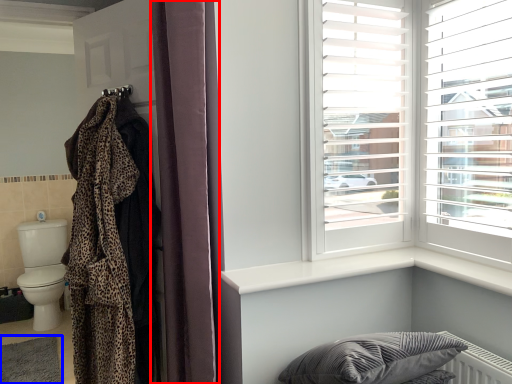
Question: Which object appears closest to the camera in this image, curtain (highlighted by a red box) or mat (highlighted by a blue box)?

Choices:
 (A) curtain
 (B) mat

Answer: (A)